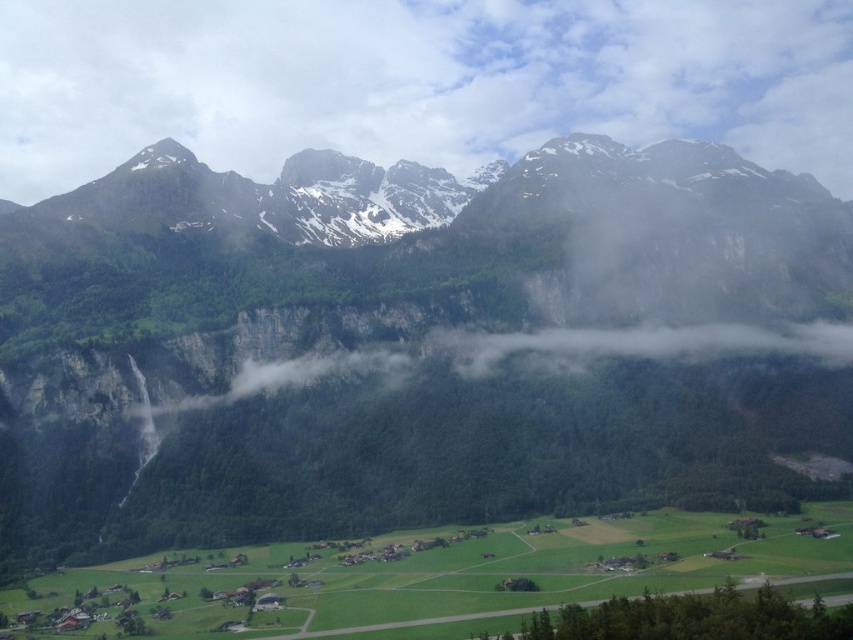
Question: Which point appears closest to the camera in this image?

Choices:
 (A) (660, 435)
 (B) (386, 38)

Answer: (A)

Question: Does green rocky mountain range at upper center have a smaller size compared to white fluffy cloud at upper center?

Choices:
 (A) no
 (B) yes

Answer: (A)

Question: Among these points, which one is farthest from the camera?

Choices:
 (A) coord(180,132)
 (B) coord(181,232)

Answer: (A)

Question: Which point appears closest to the camera in this image?

Choices:
 (A) click(440, 38)
 (B) click(663, 257)

Answer: (B)

Question: Is green rocky mountain range at upper center to the right of white fluffy cloud at upper center from the viewer's perspective?

Choices:
 (A) no
 (B) yes

Answer: (B)

Question: Is green rocky mountain range at upper center smaller than white fluffy cloud at upper center?

Choices:
 (A) no
 (B) yes

Answer: (A)